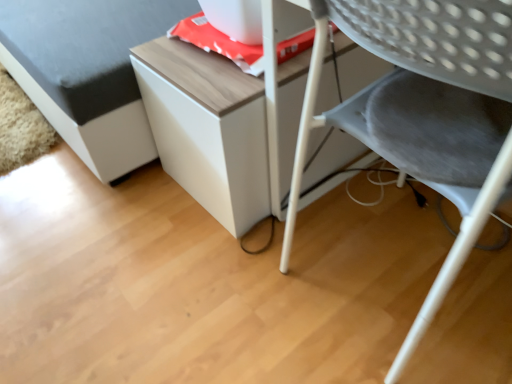
This screenshot has width=512, height=384. I want to click on free space in front of wooden table at center, so click(x=239, y=272).